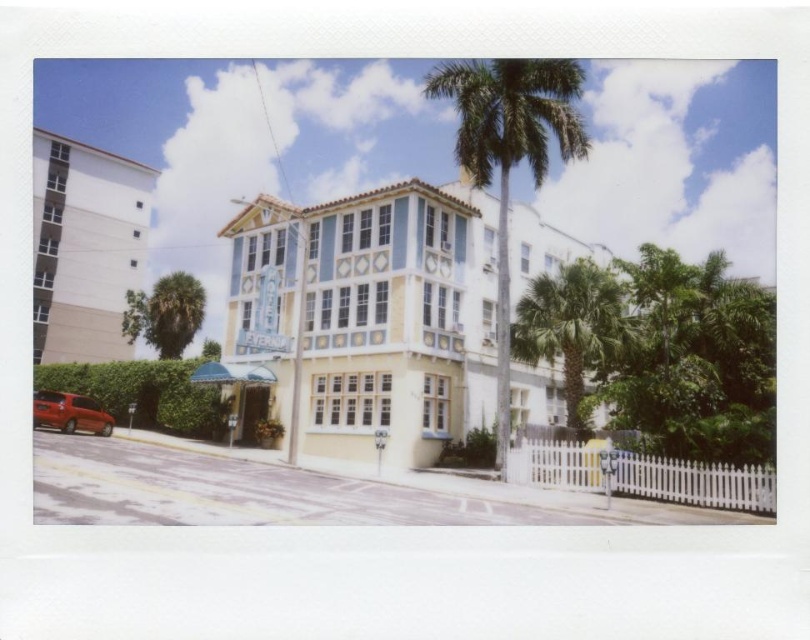
Question: Which object is positioned closest to the green leafy palm tree at center-right?

Choices:
 (A) pastel painted building at center
 (B) green leafy palm tree at center
 (C) white smooth building at left
 (D) green leafy palm tree at lower left

Answer: (B)

Question: Is green leafy palm tree at center further to camera compared to green leafy palm tree at center-right?

Choices:
 (A) yes
 (B) no

Answer: (B)

Question: Does pastel painted building at center have a greater width compared to white smooth building at left?

Choices:
 (A) no
 (B) yes

Answer: (B)

Question: Which point is farther to the camera?

Choices:
 (A) green leafy palm tree at lower left
 (B) green leafy palm tree at center-right
 (C) pastel painted building at center
 (D) green leafy palm tree at center

Answer: (A)

Question: Is pastel painted building at center positioned behind green leafy palm tree at center?

Choices:
 (A) no
 (B) yes

Answer: (B)

Question: Estimate the real-world distances between objects in this image. Which object is closer to the white smooth building at left?

Choices:
 (A) green leafy palm tree at center-right
 (B) pastel painted building at center

Answer: (B)